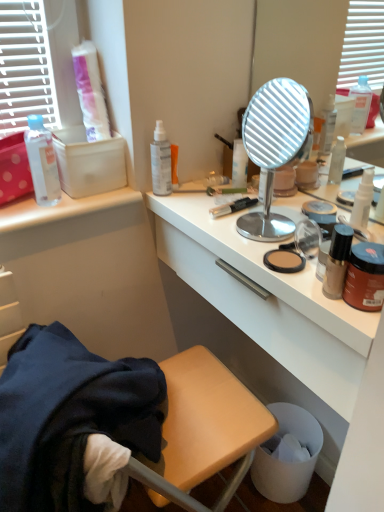
Question: Is transparent plastic spray bottle at upper center, placed as the 4th bottle when sorted from front to back, looking in the opposite direction of transparent plastic bottle at upper left, which ranks as the third bottle in front-to-back order?

Choices:
 (A) yes
 (B) no

Answer: (B)

Question: Could you tell me if transparent plastic spray bottle at upper center, placed as the 4th bottle when sorted from front to back, is turned towards transparent plastic bottle at upper left, which is the 1th bottle in left-to-right order?

Choices:
 (A) no
 (B) yes

Answer: (A)

Question: From a real-world perspective, is transparent plastic spray bottle at upper center, marked as the 1th bottle in a back-to-front arrangement, beneath transparent plastic bottle at upper left, acting as the 2th bottle starting from the back?

Choices:
 (A) yes
 (B) no

Answer: (A)

Question: Does transparent plastic spray bottle at upper center, which ranks as the 3th bottle in right-to-left order, have a lesser width compared to transparent plastic bottle at upper left, acting as the 2th bottle starting from the back?

Choices:
 (A) yes
 (B) no

Answer: (A)

Question: Does transparent plastic spray bottle at upper center, which ranks as the 3th bottle in right-to-left order, appear on the left side of transparent plastic bottle at upper left, which is the 1th bottle in left-to-right order?

Choices:
 (A) no
 (B) yes

Answer: (A)

Question: From the image's perspective, is white cardboard box at upper left positioned above or below metallic round mirror at center?

Choices:
 (A) below
 (B) above

Answer: (B)

Question: Is point (122, 150) positioned closer to the camera than point (248, 152)?

Choices:
 (A) farther
 (B) closer

Answer: (B)

Question: From a real-world perspective, is white cardboard box at upper left physically located above or below metallic round mirror at center?

Choices:
 (A) below
 (B) above

Answer: (A)

Question: Considering the positions of white cardboard box at upper left and metallic round mirror at center in the image, is white cardboard box at upper left taller or shorter than metallic round mirror at center?

Choices:
 (A) short
 (B) tall

Answer: (A)

Question: Which is correct: white cardboard box at upper left is inside brown matte jar at right, or outside of it?

Choices:
 (A) inside
 (B) outside

Answer: (B)

Question: From the image's perspective, is white cardboard box at upper left positioned above or below brown matte jar at right?

Choices:
 (A) below
 (B) above

Answer: (B)

Question: From a real-world perspective, is white cardboard box at upper left physically located above or below brown matte jar at right?

Choices:
 (A) above
 (B) below

Answer: (A)

Question: Considering the positions of point (124, 153) and point (372, 301), is point (124, 153) closer or farther from the camera than point (372, 301)?

Choices:
 (A) closer
 (B) farther

Answer: (B)

Question: From the image's perspective, is white glossy desk at center above or below white plastic trash can at lower right?

Choices:
 (A) below
 (B) above

Answer: (B)

Question: Based on their sizes in the image, would you say white glossy desk at center is bigger or smaller than white plastic trash can at lower right?

Choices:
 (A) small
 (B) big

Answer: (B)